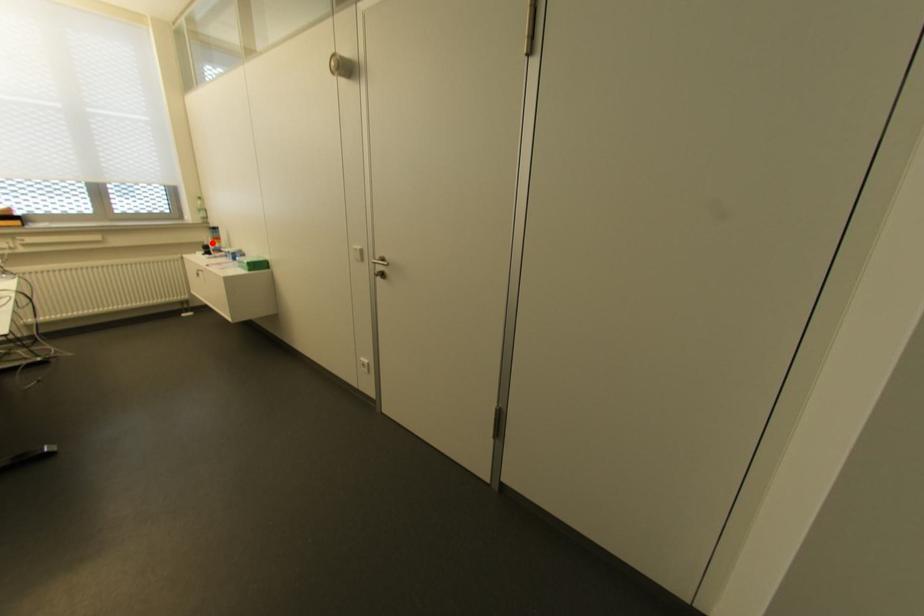
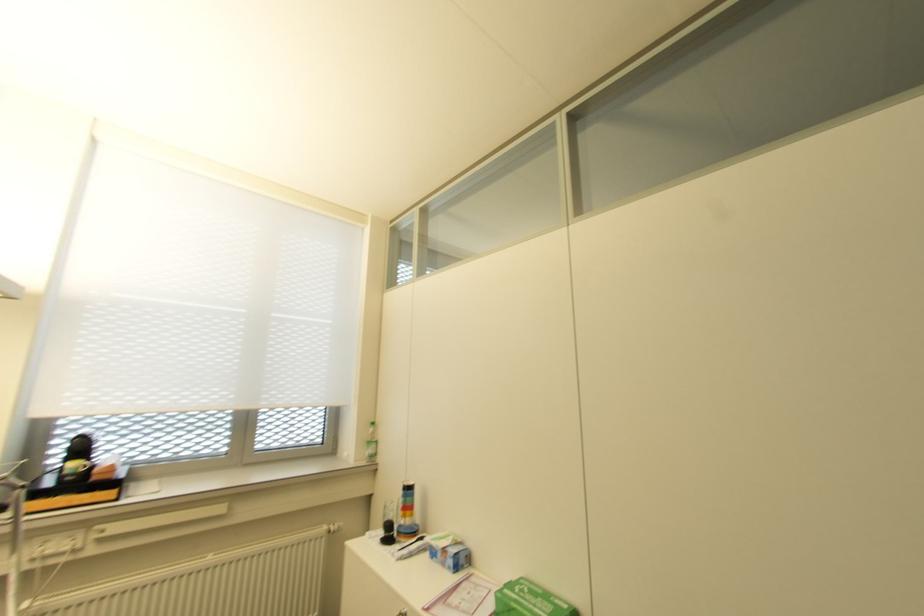
Question: I am providing you with two images of the same scene from different viewpoints. A red point is shown in image1. For the corresponding object point in image2, is it positioned nearer or farther from the camera?

Choices:
 (A) Nearer
 (B) Farther

Answer: (B)